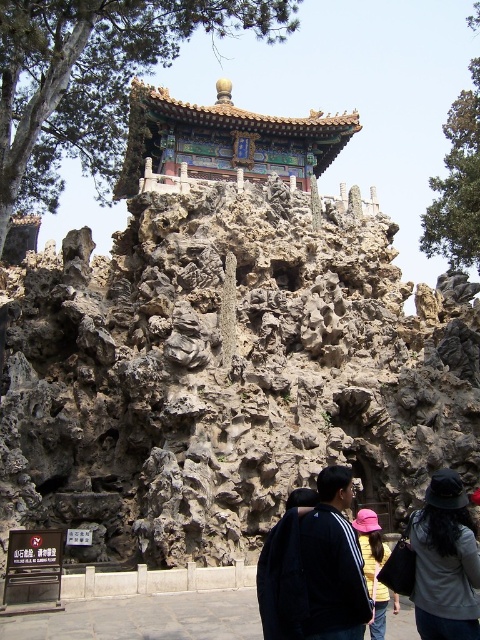
Question: Which object is closer to the camera taking this photo?

Choices:
 (A) black matte jacket at lower center
 (B) pink fabric hat at center
 (C) gray fabric hat at lower right

Answer: (A)

Question: In this image, where is gray fabric hat at lower right located relative to pink fabric hat at center?

Choices:
 (A) above
 (B) below

Answer: (A)

Question: Is the position of brown rough rock face at center less distant than that of gray fabric hat at lower right?

Choices:
 (A) no
 (B) yes

Answer: (A)

Question: Is brown rough rock face at center wider than gray fabric hat at lower right?

Choices:
 (A) no
 (B) yes

Answer: (B)

Question: Based on their relative distances, which object is nearer to the black matte jacket at lower center?

Choices:
 (A) gray fabric hat at lower right
 (B) brown rough rock face at center

Answer: (A)

Question: Which point is farther to the camera?

Choices:
 (A) gray fabric hat at lower right
 (B) black matte jacket at lower center

Answer: (A)